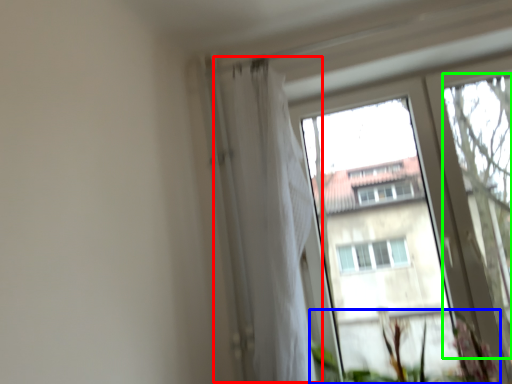
Question: Considering the real-world distances, which object is farthest from shower curtain (highlighted by a red box)? vegetation (highlighted by a blue box) or tree (highlighted by a green box)?

Choices:
 (A) vegetation
 (B) tree

Answer: (B)